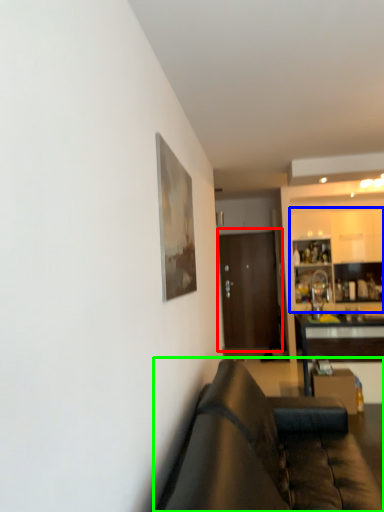
Question: Which object is the farthest from door (highlighted by a red box)? Choose among these: cabinetry (highlighted by a blue box) or studio couch (highlighted by a green box).

Choices:
 (A) cabinetry
 (B) studio couch

Answer: (B)